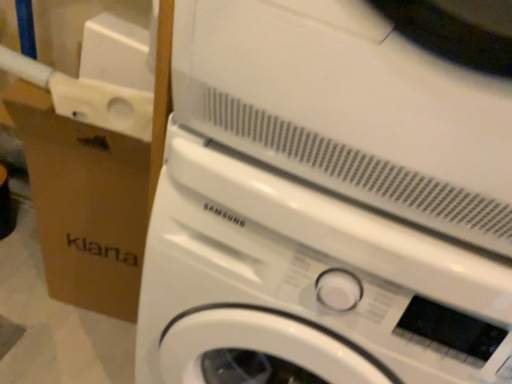
Question: Is white glossy washing machine at center shorter than brown cardboard at left?

Choices:
 (A) yes
 (B) no

Answer: (B)

Question: Considering the relative sizes of white glossy washing machine at center and brown cardboard at left in the image provided, is white glossy washing machine at center thinner than brown cardboard at left?

Choices:
 (A) no
 (B) yes

Answer: (A)

Question: Is white glossy washing machine at center positioned behind brown cardboard at left?

Choices:
 (A) no
 (B) yes

Answer: (A)

Question: From the image's perspective, is white glossy washing machine at center over brown cardboard at left?

Choices:
 (A) no
 (B) yes

Answer: (A)

Question: Does white glossy washing machine at center have a greater width compared to brown cardboard at left?

Choices:
 (A) yes
 (B) no

Answer: (A)

Question: From a real-world perspective, is white glossy washing machine at center below brown cardboard at left?

Choices:
 (A) no
 (B) yes

Answer: (A)

Question: From a real-world perspective, is brown cardboard at left on white glossy washing machine at center?

Choices:
 (A) yes
 (B) no

Answer: (B)

Question: Can you confirm if brown cardboard at left is bigger than white glossy washing machine at center?

Choices:
 (A) no
 (B) yes

Answer: (A)

Question: Can you confirm if brown cardboard at left is thinner than white glossy washing machine at center?

Choices:
 (A) no
 (B) yes

Answer: (B)

Question: Does brown cardboard at left touch white glossy washing machine at center?

Choices:
 (A) yes
 (B) no

Answer: (B)

Question: Is brown cardboard at left wider than white glossy washing machine at center?

Choices:
 (A) no
 (B) yes

Answer: (A)

Question: Does brown cardboard at left have a greater height compared to white glossy washing machine at center?

Choices:
 (A) no
 (B) yes

Answer: (A)

Question: Considering the positions of point (164, 92) and point (421, 52), is point (164, 92) closer or farther from the camera than point (421, 52)?

Choices:
 (A) closer
 (B) farther

Answer: (B)